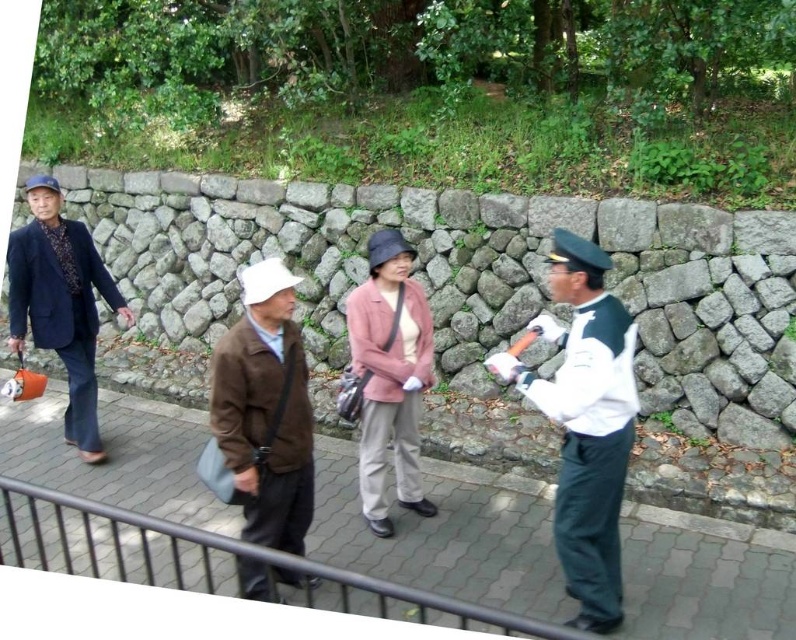
Question: Which point is farther from the camera taking this photo?

Choices:
 (A) (724, 621)
 (B) (361, 324)

Answer: (B)

Question: Estimate the real-world distances between objects in this image. Which object is closer to the brown leather jacket at center?

Choices:
 (A) dark blue textured suit at left
 (B) white uniform at center

Answer: (B)

Question: Can you confirm if gray cobblestone pavement at center is positioned below dark blue textured suit at left?

Choices:
 (A) yes
 (B) no

Answer: (A)

Question: Is brown leather jacket at center smaller than dark blue textured suit at left?

Choices:
 (A) no
 (B) yes

Answer: (B)

Question: Can you confirm if brown leather jacket at center is thinner than dark blue textured suit at left?

Choices:
 (A) no
 (B) yes

Answer: (B)

Question: Considering the real-world distances, which object is farthest from the brown leather jacket at center?

Choices:
 (A) dark blue textured suit at left
 (B) gray cobblestone pavement at center
 (C) white uniform at center
 (D) pink fabric jacket at center

Answer: (A)